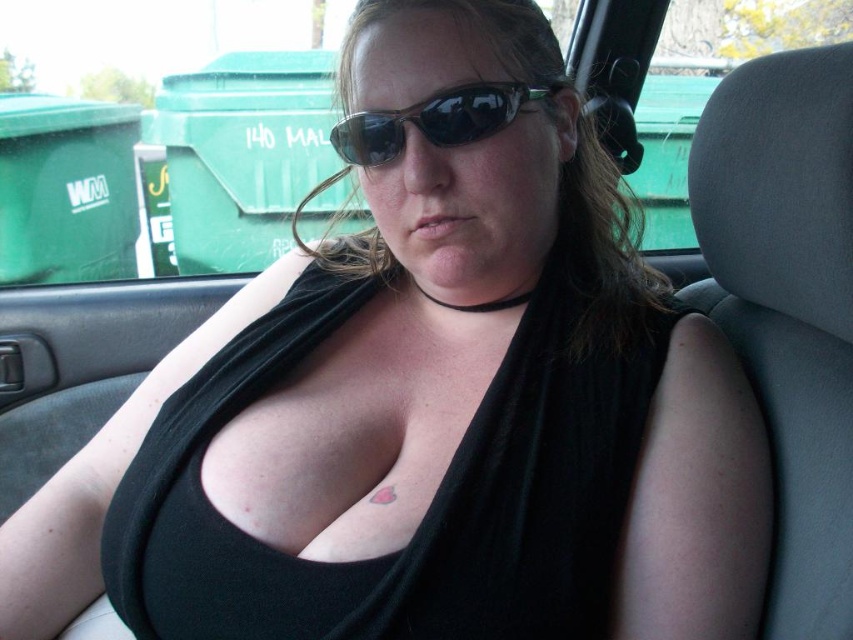
Question: Is black fabric bikini top at center positioned before black plastic sunglasses at center?

Choices:
 (A) yes
 (B) no

Answer: (A)

Question: Among these points, which one is farthest from the camera?

Choices:
 (A) (514, 84)
 (B) (265, 568)

Answer: (A)

Question: Is black fabric bikini top at center thinner than black plastic sunglasses at center?

Choices:
 (A) no
 (B) yes

Answer: (A)

Question: Does black fabric bikini top at center come behind black plastic sunglasses at center?

Choices:
 (A) yes
 (B) no

Answer: (B)

Question: Which object is closer to the camera taking this photo?

Choices:
 (A) black plastic sunglasses at center
 (B) black fabric bikini top at center

Answer: (B)

Question: Which point is closer to the camera?

Choices:
 (A) black plastic sunglasses at center
 (B) black fabric bikini top at center

Answer: (B)